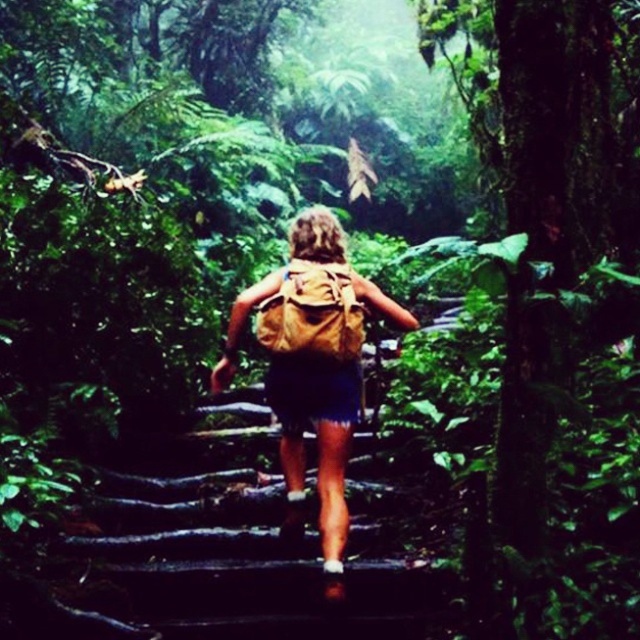
You are a hiker carrying a 5.5 feet long backpack. You come across wooden steps at center. Can you safely carry your backpack through the steps?

The wooden steps at center are 9.40 feet apart. Since your backpack is 5.5 feet long, it will fit between the steps as the distance between them is greater than the backpack length.

You are a hiker who just noticed two backpacks in front of you on the trail. The backpacks are the brown fabric backpack at center and the brown canvas backpack at center. Which backpack is closer to you?

The brown fabric backpack at center is closer to you since it is only 4.12 inches away from the brown canvas backpack at center, but without knowing the exact distance from the observer, we cannot determine which is closer. Wait, the description says the fabric backpack is 4.12 inches from the canvas one, but the question asks which is closer to the observer. The given info only tells the distance between them, not their positions relative to the observer. Hmm, maybe the question is flawed. Alternatively, I

You are navigating a jungle trail and need to step carefully between two points marked as point (264, 426) and point (282, 368). Which point should you step on first to stay closer to the trail?

Point (264, 426) is further to the viewer than point (282, 368). Therefore, stepping on point (264, 426) first would keep you closer to the trail since it is nearer to your current position.